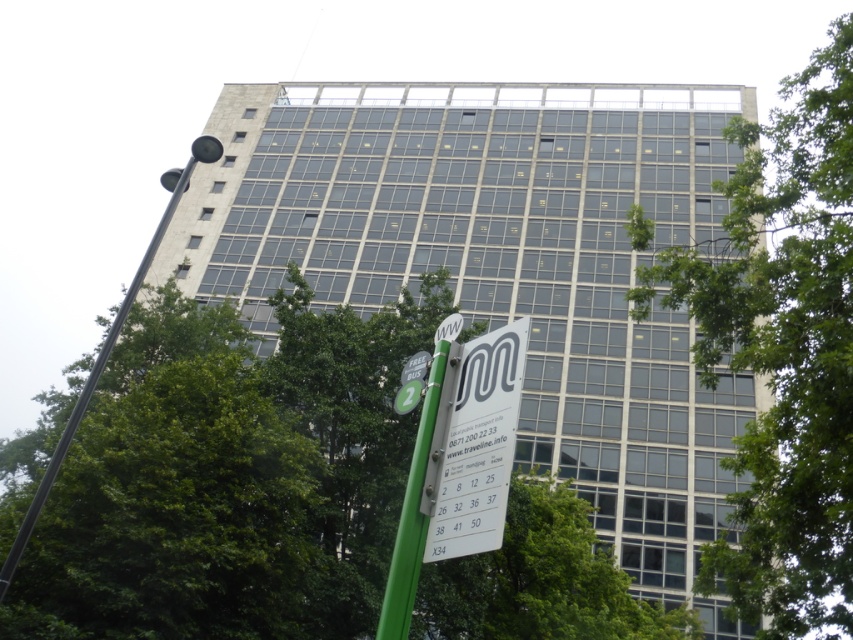
You are standing in front of the building and notice two green leafy trees. One is labeled as the green leafy tree at center and the other as the green leafy tree at lower center. Which tree is positioned higher up in the image?

The green leafy tree at center is positioned higher up in the image compared to the green leafy tree at lower center.

You are a delivery person trying to attach a parcel label to either the white plastic sign at lower center or the black metal pole at left. Which object would you choose if you need to ensure the label fits without overlapping the edges?

The white plastic sign at lower center has a lesser width compared to the black metal pole at left, so the label would fit better on the white plastic sign at lower center without overlapping the edges.